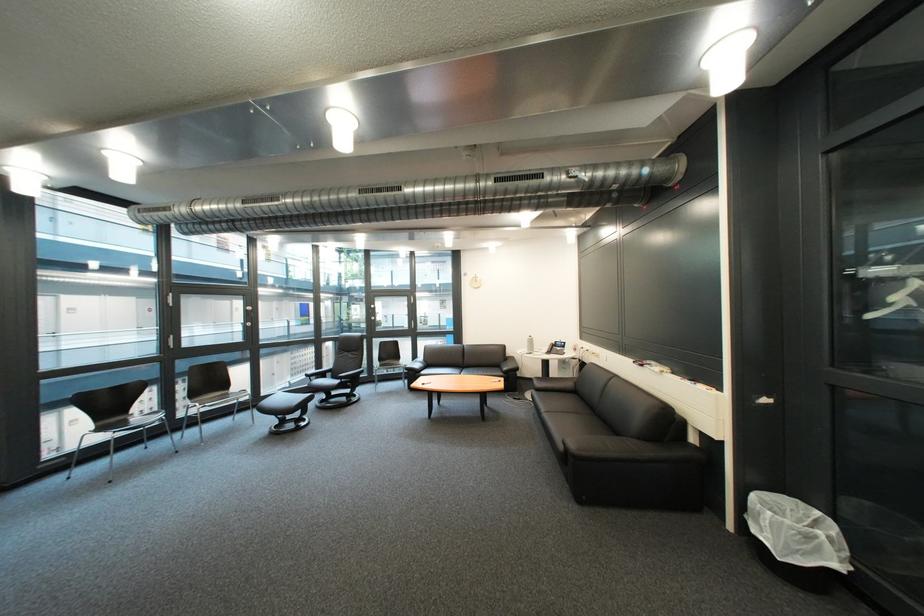
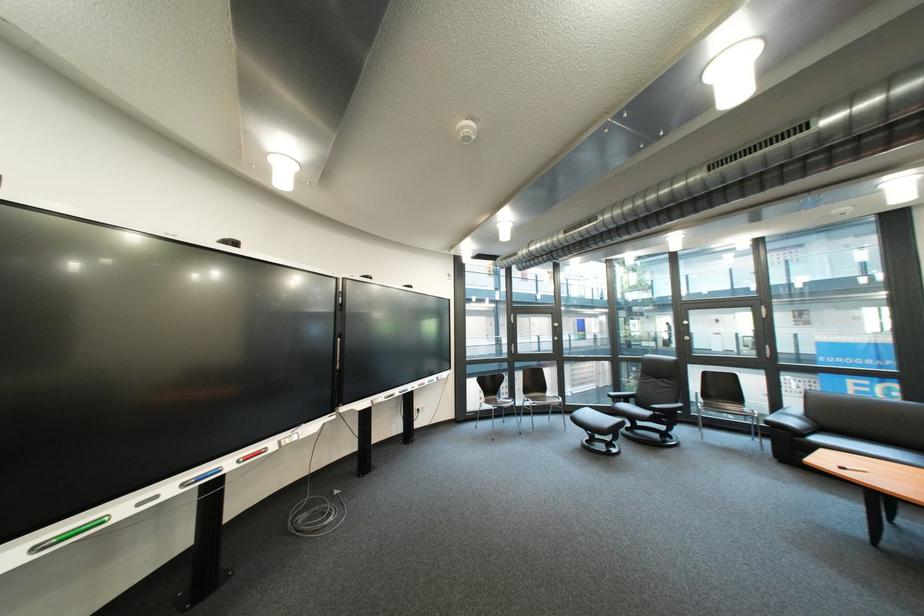
Where in the second image is the point corresponding to (289,428) from the first image?

(601, 443)